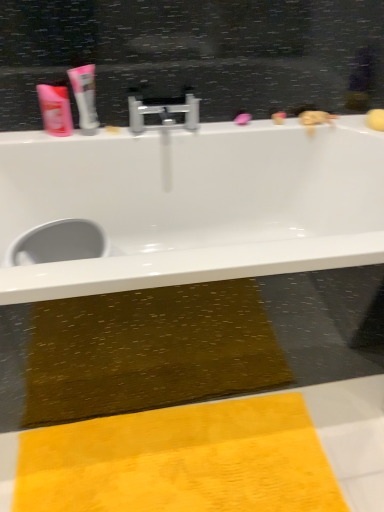
Question: From a real-world perspective, is silver metallic faucet at center positioned under white glossy tube at upper left based on gravity?

Choices:
 (A) no
 (B) yes

Answer: (B)

Question: From the image's perspective, would you say silver metallic faucet at center is positioned over white glossy tube at upper left?

Choices:
 (A) no
 (B) yes

Answer: (A)

Question: Can you confirm if silver metallic faucet at center is positioned to the right of white glossy tube at upper left?

Choices:
 (A) no
 (B) yes

Answer: (B)

Question: From the image's perspective, does silver metallic faucet at center appear lower than white glossy tube at upper left?

Choices:
 (A) no
 (B) yes

Answer: (B)

Question: Is silver metallic faucet at center completely or partially outside of white glossy tube at upper left?

Choices:
 (A) yes
 (B) no

Answer: (A)

Question: Is silver metallic faucet at center at the left side of white glossy tube at upper left?

Choices:
 (A) no
 (B) yes

Answer: (A)

Question: From a real-world perspective, is white glossy tube at upper left below white glossy bathtub at upper center?

Choices:
 (A) no
 (B) yes

Answer: (A)

Question: Could you tell me if white glossy tube at upper left is turned towards white glossy bathtub at upper center?

Choices:
 (A) yes
 (B) no

Answer: (B)

Question: Is white glossy bathtub at upper center at the back of white glossy tube at upper left?

Choices:
 (A) yes
 (B) no

Answer: (B)

Question: Does white glossy tube at upper left have a larger size compared to white glossy bathtub at upper center?

Choices:
 (A) yes
 (B) no

Answer: (B)

Question: From the image's perspective, is white glossy tube at upper left over white glossy bathtub at upper center?

Choices:
 (A) no
 (B) yes

Answer: (B)

Question: Would you say white glossy bathtub at upper center is part of white glossy tube at upper left's contents?

Choices:
 (A) yes
 (B) no

Answer: (B)

Question: Is yellow textured towel at lower center next to white glossy tube at upper left?

Choices:
 (A) yes
 (B) no

Answer: (B)